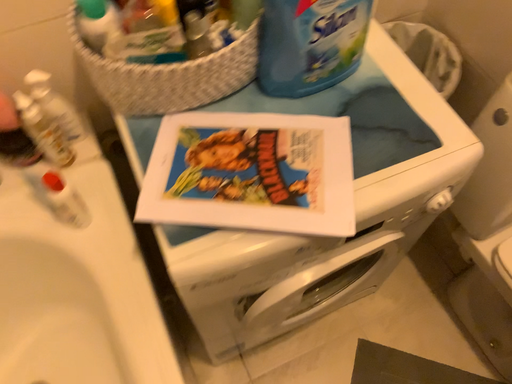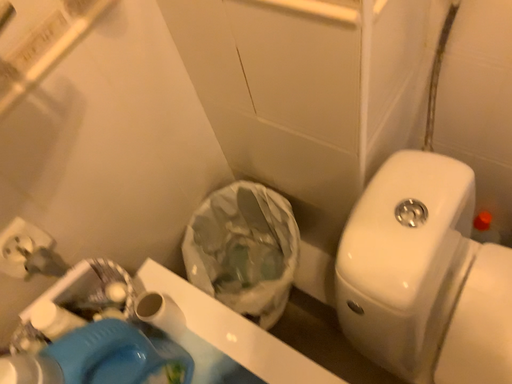
Question: How did the camera likely rotate when shooting the video?

Choices:
 (A) rotated left
 (B) rotated right

Answer: (B)